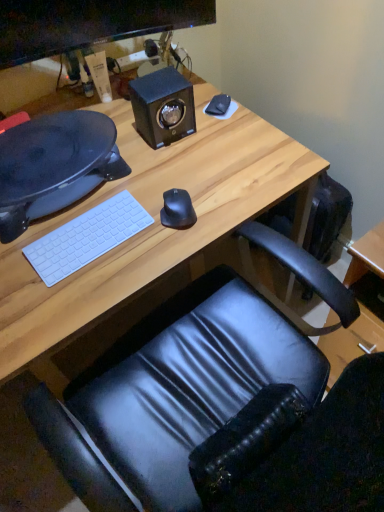
Locate an element on the screen. vacant space situated on the left part of black matte mouse at center is located at coordinates (132, 238).